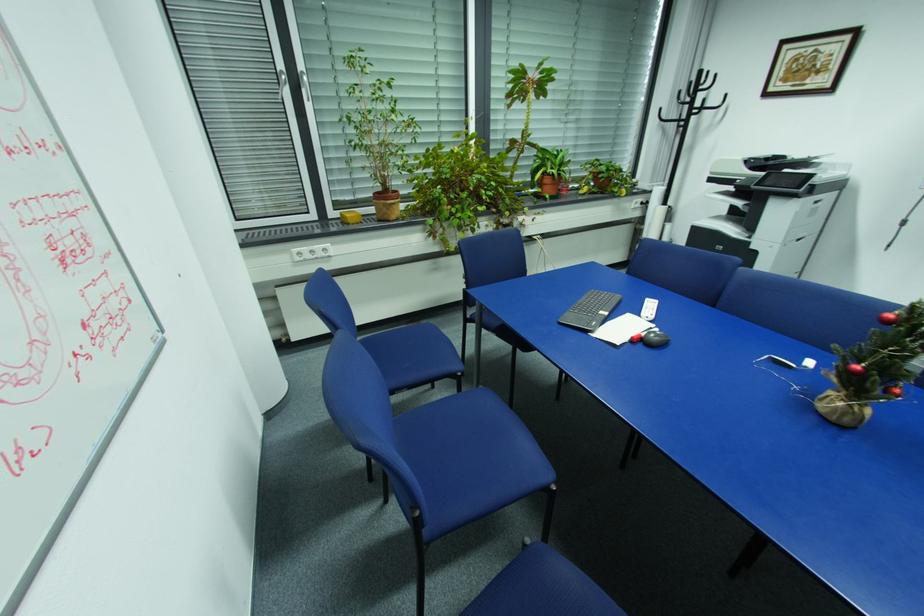
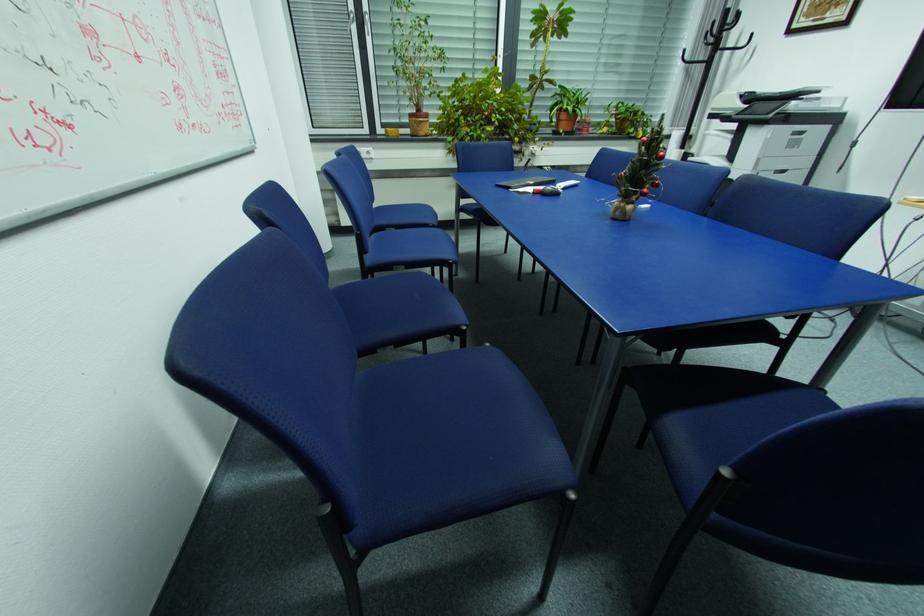
What movement of the cameraman would produce the second image?

The cameraman walked toward right, backward.